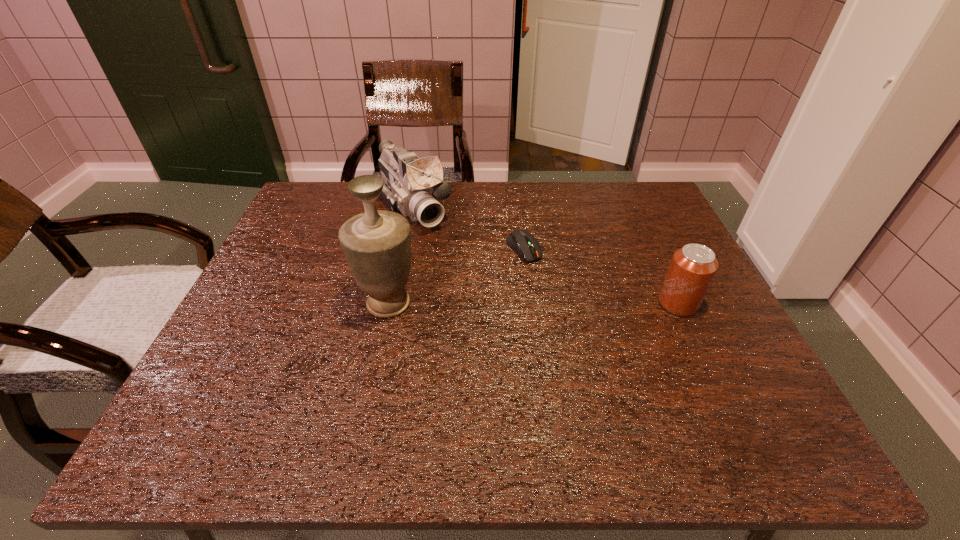
Image resolution: width=960 pixels, height=540 pixels. In order to click on vacant space at the far left corner of the desktop in this screenshot , I will do `click(341, 188)`.

Where is `free point at the near right corner`? The width and height of the screenshot is (960, 540). free point at the near right corner is located at coordinates (716, 400).

Locate an element on the screen. This screenshot has width=960, height=540. vacant region between the second object from right to left and the second tallest object is located at coordinates (468, 228).

The height and width of the screenshot is (540, 960). In order to click on vacant space that's between the rightmost object and the second tallest object in this screenshot , I will do `click(544, 255)`.

Identify the location of free space between the second shortest object and the urn. Image resolution: width=960 pixels, height=540 pixels. (533, 303).

Identify the location of vacant space in between the shortest object and the rightmost object. (601, 276).

This screenshot has height=540, width=960. Identify the location of free space between the camcorder and the computer equipment. (468, 228).

Image resolution: width=960 pixels, height=540 pixels. What are the coordinates of `unoccupied area between the urn and the rightmost object` in the screenshot? It's located at (533, 303).

Image resolution: width=960 pixels, height=540 pixels. Find the location of `empty location between the tallest object and the rightmost object`. empty location between the tallest object and the rightmost object is located at coordinates (533, 303).

Where is `free space between the can and the computer equipment`? This screenshot has height=540, width=960. free space between the can and the computer equipment is located at coordinates (601, 276).